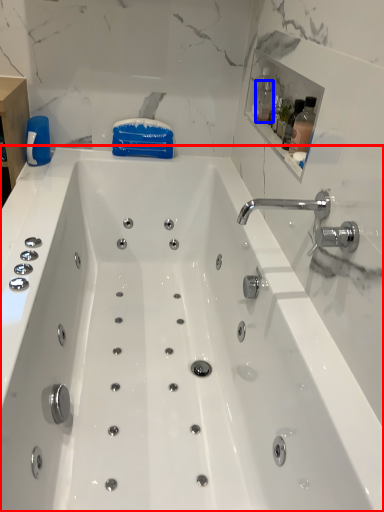
Question: Among these objects, which one is farthest to the camera, bathtub (highlighted by a red box) or bottle (highlighted by a blue box)?

Choices:
 (A) bathtub
 (B) bottle

Answer: (B)